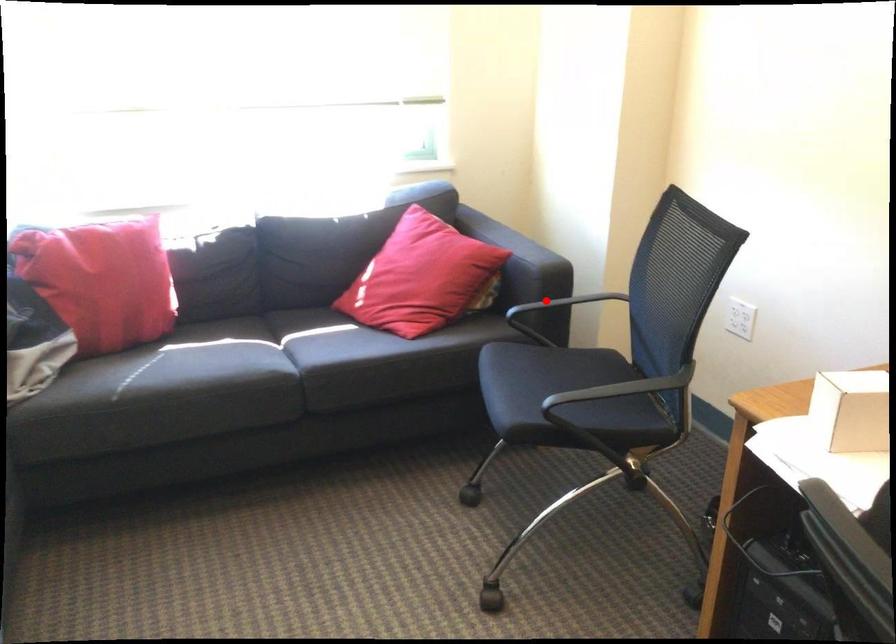
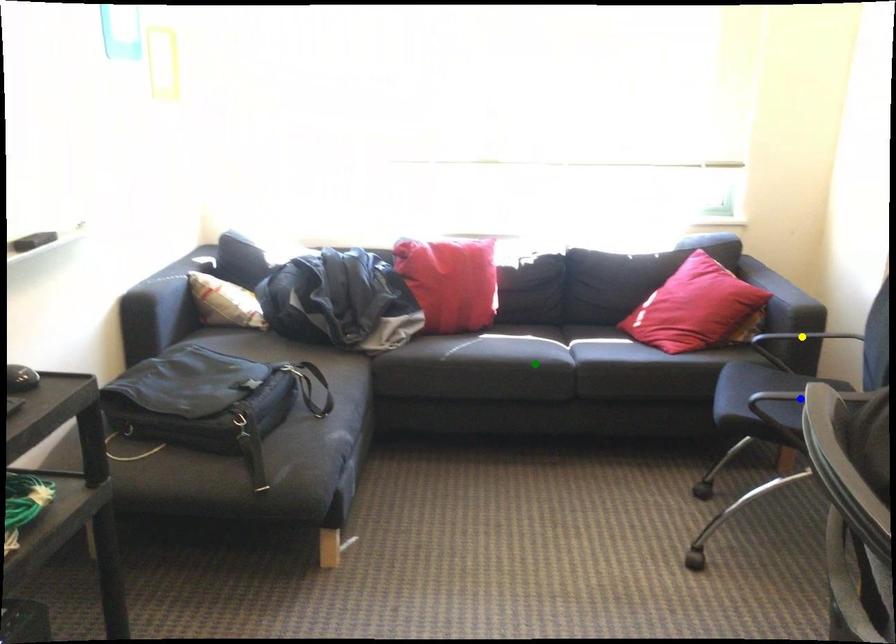
Question: I am providing you with two images of the same scene from different viewpoints. A red point is marked on the first image. You are given multiple points on the second image. Which spot in image 2 lines up with the point in image 1?

Choices:
 (A) yellow point
 (B) green point
 (C) blue point

Answer: (A)